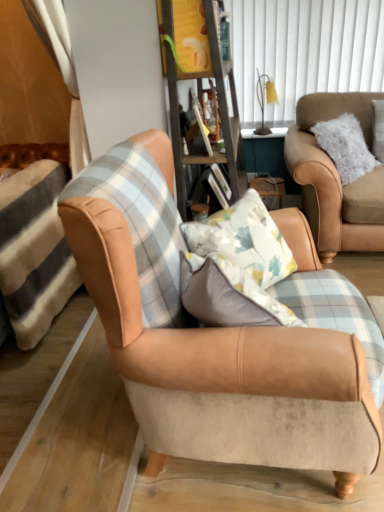
What is the approximate height of yellow fabric lampshade at upper center?

yellow fabric lampshade at upper center is 18.12 inches in height.

Locate an element on the screen. The width and height of the screenshot is (384, 512). yellow fabric lampshade at upper center is located at coordinates (263, 100).

The image size is (384, 512). Identify the location of wooden bookshelf at center. (199, 87).

What do you see at coordinates (199, 87) in the screenshot? This screenshot has height=512, width=384. I see `wooden bookshelf at center` at bounding box center [199, 87].

The image size is (384, 512). What are the coordinates of `suede tan armchair at right, marked as the second chair in a front-to-back arrangement` in the screenshot? It's located at (336, 178).

I want to click on yellow fabric lampshade at upper center, so click(263, 100).

How different are the orientations of white vertical blinds at upper center and tan suede armchair at center, the 2th chair when ordered from right to left, in degrees?

The facing directions of white vertical blinds at upper center and tan suede armchair at center, the 2th chair when ordered from right to left, are 88.1 degrees apart.

Considering the sizes of objects white vertical blinds at upper center and tan suede armchair at center, the 1th chair when ordered from front to back, in the image provided, who is thinner, white vertical blinds at upper center or tan suede armchair at center, the 1th chair when ordered from front to back,?

Thinner between the two is white vertical blinds at upper center.

Find the location of a particular element. chair on the left of white vertical blinds at upper center is located at coordinates (222, 359).

Consider the image. From the image's perspective, is white vertical blinds at upper center on top of tan suede armchair at center, the 1th chair when ordered from front to back?

Yes, from the image's perspective, white vertical blinds at upper center is above tan suede armchair at center, the 1th chair when ordered from front to back.

Considering the sizes of objects suede tan armchair at right, placed as the 1th chair when sorted from right to left, and tan suede armchair at center, the 2th chair when ordered from right to left, in the image provided, who is thinner, suede tan armchair at right, placed as the 1th chair when sorted from right to left, or tan suede armchair at center, the 2th chair when ordered from right to left,?

tan suede armchair at center, the 2th chair when ordered from right to left, is thinner.

Is suede tan armchair at right, the second chair when ordered from left to right, positioned with its back to tan suede armchair at center, the 2th chair when ordered from right to left?

That's not correct — suede tan armchair at right, the second chair when ordered from left to right, is not looking away from tan suede armchair at center, the 2th chair when ordered from right to left.

Considering the relative sizes of suede tan armchair at right, the second chair when ordered from left to right, and tan suede armchair at center, which ranks as the 2th chair in back-to-front order, in the image provided, is suede tan armchair at right, the second chair when ordered from left to right, shorter than tan suede armchair at center, which ranks as the 2th chair in back-to-front order,?

Yes.

In the scene shown: Does white vertical blinds at upper center touch yellow fabric lampshade at upper center?

white vertical blinds at upper center and yellow fabric lampshade at upper center are not in contact.

Can you confirm if white vertical blinds at upper center is shorter than yellow fabric lampshade at upper center?

No, white vertical blinds at upper center is not shorter than yellow fabric lampshade at upper center.

You are a GUI agent. You are given a task and a screenshot of the screen. Output one action in this format:
    pyautogui.click(x=<x>, y=<y>)
    Task: Click on the lamp below the white vertical blinds at upper center (from the image's perspective)
    This screenshot has width=384, height=512.
    Given the screenshot: What is the action you would take?
    pyautogui.click(x=263, y=100)

Considering the sizes of objects wooden bookshelf at center and tan suede armchair at center, which ranks as the 2th chair in back-to-front order, in the image provided, who is wider, wooden bookshelf at center or tan suede armchair at center, which ranks as the 2th chair in back-to-front order,?

tan suede armchair at center, which ranks as the 2th chair in back-to-front order.

Considering the relative positions of wooden bookshelf at center and tan suede armchair at center, the 2th chair when ordered from right to left, in the image provided, is wooden bookshelf at center in front of tan suede armchair at center, the 2th chair when ordered from right to left,?

No.

Based on their sizes in the image, would you say wooden bookshelf at center is bigger or smaller than tan suede armchair at center, which ranks as the 2th chair in back-to-front order?

Clearly, wooden bookshelf at center is smaller in size than tan suede armchair at center, which ranks as the 2th chair in back-to-front order.

Where is `bookshelf above the tan suede armchair at center, positioned as the 1th chair in left-to-right order (from the image's perspective)`? bookshelf above the tan suede armchair at center, positioned as the 1th chair in left-to-right order (from the image's perspective) is located at coordinates (199, 87).

In the scene shown: Is tan suede armchair at center, positioned as the 1th chair in left-to-right order, not close to wooden bookshelf at center?

Yes, tan suede armchair at center, positioned as the 1th chair in left-to-right order, is far from wooden bookshelf at center.

Based on the photo, can you confirm if tan suede armchair at center, positioned as the 1th chair in left-to-right order, is positioned to the left of wooden bookshelf at center?

Yes, tan suede armchair at center, positioned as the 1th chair in left-to-right order, is to the left of wooden bookshelf at center.

From a real-world perspective, is tan suede armchair at center, the 1th chair when ordered from front to back, above or below wooden bookshelf at center?

tan suede armchair at center, the 1th chair when ordered from front to back, is situated lower than wooden bookshelf at center in the real world.

Which is behind, point (299, 333) or point (189, 23)?

The point (189, 23) is more distant.

Is wooden bookshelf at center positioned with its back to yellow fabric lampshade at upper center?

No, wooden bookshelf at center is not facing the opposite direction of yellow fabric lampshade at upper center.

In the scene shown: Are wooden bookshelf at center and yellow fabric lampshade at upper center beside each other?

No, wooden bookshelf at center is not beside yellow fabric lampshade at upper center.

Is wooden bookshelf at center behind yellow fabric lampshade at upper center?

No.

Can you see tan suede armchair at center, the 1th chair when ordered from front to back, touching yellow fabric lampshade at upper center?

No, tan suede armchair at center, the 1th chair when ordered from front to back, is not next to yellow fabric lampshade at upper center.

How many degrees apart are the facing directions of tan suede armchair at center, the 1th chair when ordered from front to back, and yellow fabric lampshade at upper center?

There is a 90-degree angle between the facing directions of tan suede armchair at center, the 1th chair when ordered from front to back, and yellow fabric lampshade at upper center.

Considering the relative sizes of tan suede armchair at center, the 2th chair when ordered from right to left, and yellow fabric lampshade at upper center in the image provided, is tan suede armchair at center, the 2th chair when ordered from right to left, smaller than yellow fabric lampshade at upper center?

Actually, tan suede armchair at center, the 2th chair when ordered from right to left, might be larger than yellow fabric lampshade at upper center.

Where is `window screen that is above the tan suede armchair at center, positioned as the 1th chair in left-to-right order (from the image's perspective)`? The image size is (384, 512). window screen that is above the tan suede armchair at center, positioned as the 1th chair in left-to-right order (from the image's perspective) is located at coordinates (304, 50).

Identify the location of chair that is in front of the suede tan armchair at right, the 1th chair from the back. This screenshot has height=512, width=384. (222, 359).

In the scene shown: Considering their positions, is yellow fabric lampshade at upper center positioned further to white vertical blinds at upper center than wooden bookshelf at center?

wooden bookshelf at center lies further to white vertical blinds at upper center than the other object.

From the image, which object appears to be nearer to tan suede armchair at center, which ranks as the 2th chair in back-to-front order, yellow fabric lampshade at upper center or wooden bookshelf at center?

Among the two, wooden bookshelf at center is located nearer to tan suede armchair at center, which ranks as the 2th chair in back-to-front order.

Looking at the image, which one is located closer to tan suede armchair at center, the 1th chair when ordered from front to back, wooden bookshelf at center or yellow fabric lampshade at upper center?

Based on the image, wooden bookshelf at center appears to be nearer to tan suede armchair at center, the 1th chair when ordered from front to back.

Based on their spatial positions, is suede tan armchair at right, the second chair when ordered from left to right, or tan suede armchair at center, the 2th chair when ordered from right to left, further from yellow fabric lampshade at upper center?

tan suede armchair at center, the 2th chair when ordered from right to left.

Based on their spatial positions, is tan suede armchair at center, the 2th chair when ordered from right to left, or white vertical blinds at upper center closer to yellow fabric lampshade at upper center?

white vertical blinds at upper center is closer to yellow fabric lampshade at upper center.

Looking at the image, which one is located closer to wooden bookshelf at center, tan suede armchair at center, positioned as the 1th chair in left-to-right order, or white vertical blinds at upper center?

The object closer to wooden bookshelf at center is tan suede armchair at center, positioned as the 1th chair in left-to-right order.

Looking at the image, which one is located further to suede tan armchair at right, the second chair when ordered from left to right, wooden bookshelf at center or white vertical blinds at upper center?

Based on the image, white vertical blinds at upper center appears to be further to suede tan armchair at right, the second chair when ordered from left to right.

Consider the image. From the image, which object appears to be farther from white vertical blinds at upper center, wooden bookshelf at center or yellow fabric lampshade at upper center?

wooden bookshelf at center.

Find the location of `chair between wooden bookshelf at center and yellow fabric lampshade at upper center from front to back`. chair between wooden bookshelf at center and yellow fabric lampshade at upper center from front to back is located at coordinates (336, 178).

Identify the location of bookshelf between tan suede armchair at center, which ranks as the 2th chair in back-to-front order, and yellow fabric lampshade at upper center, along the z-axis. This screenshot has width=384, height=512. (199, 87).

At what (x,y) coordinates should I click in order to perform the action: click on chair located between tan suede armchair at center, which ranks as the 2th chair in back-to-front order, and white vertical blinds at upper center in the depth direction. Please return your answer as a coordinate pair (x, y). The image size is (384, 512). Looking at the image, I should click on (336, 178).

The height and width of the screenshot is (512, 384). I want to click on window screen located between wooden bookshelf at center and yellow fabric lampshade at upper center in the depth direction, so click(x=304, y=50).